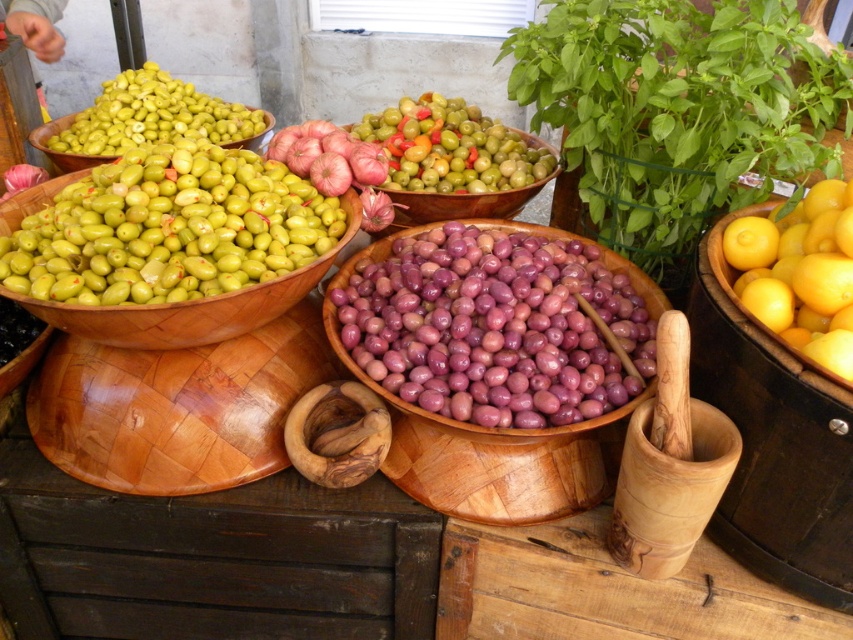
You are a customer at the market stall and want to buy the widest bowl of olives. Which bowl should you choose between the purple glossy olives at center and the matte green olives at upper left?

The purple glossy olives at center has a larger width than the matte green olives at upper left, so you should choose the purple glossy olives at center.

You are a customer at the market stall and want to pick up both the green matte olives at left and the green matte olives at center. If your arms can reach 20 inches, can you grab both without moving your position?

The green matte olives at left is 19.70 inches away from the green matte olives at center, so yes, you can grab both without moving since the distance is within your reach.